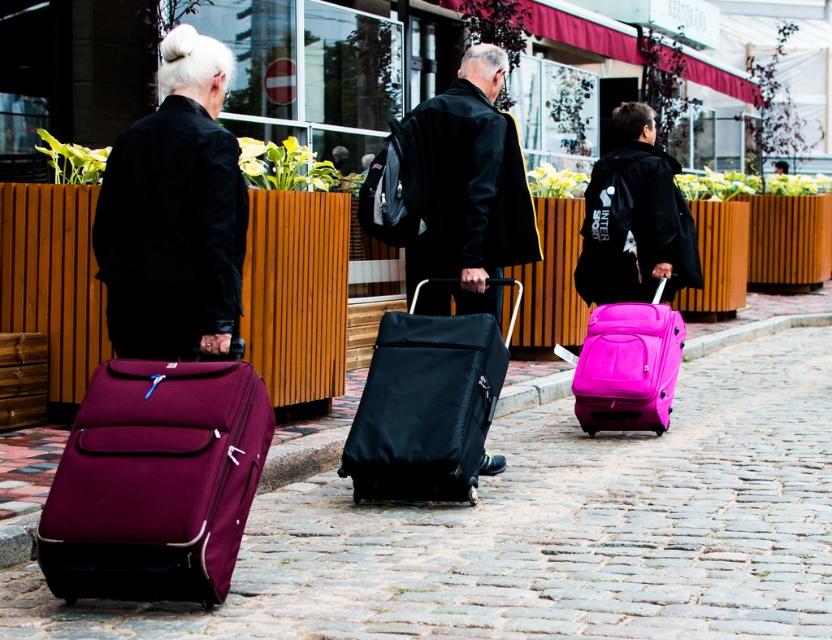
Question: Among these objects, which one is nearest to the camera?

Choices:
 (A) matte black jacket at center
 (B) burgundy fabric suitcase at lower left

Answer: (B)

Question: Does burgundy fabric suitcase at lower left appear over matte black suitcase at center?

Choices:
 (A) no
 (B) yes

Answer: (A)

Question: Which object is the closest to the pink matte suitcase at right?

Choices:
 (A) marble pavement at center
 (B) matte black jacket at center
 (C) black fabric suitcase at center
 (D) burgundy fabric suitcase at lower left

Answer: (B)

Question: Which object is closer to the camera taking this photo?

Choices:
 (A) marble pavement at center
 (B) matte black jacket at upper left

Answer: (B)

Question: Is marble pavement at center bigger than pink matte suitcase at right?

Choices:
 (A) no
 (B) yes

Answer: (A)

Question: Can you confirm if burgundy fabric suitcase at lower left is bigger than pink matte suitcase at right?

Choices:
 (A) no
 (B) yes

Answer: (B)